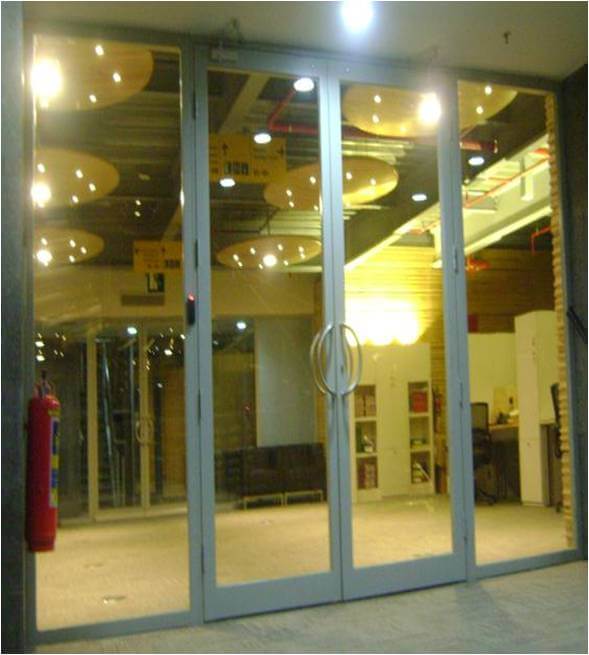
Where is `floor`? The height and width of the screenshot is (655, 589). floor is located at coordinates (349, 626), (283, 538).